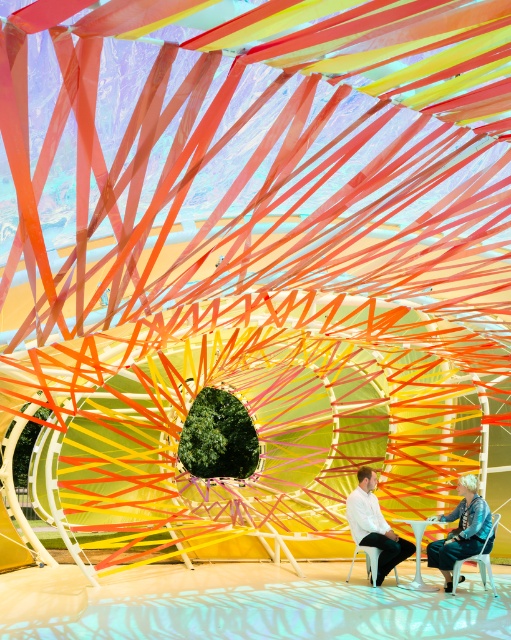
Question: Which is farther from the white plastic chair at lower center?

Choices:
 (A) denim jacket at lower right
 (B) white plastic chair at lower right

Answer: (B)

Question: Is the position of white glossy chair at center less distant than that of white plastic chair at lower center?

Choices:
 (A) yes
 (B) no

Answer: (B)

Question: Which point appears closest to the camera in this image?

Choices:
 (A) coord(355,557)
 (B) coord(467,484)

Answer: (B)

Question: Is white plastic chairs at center thinner than denim jacket at lower right?

Choices:
 (A) yes
 (B) no

Answer: (B)

Question: Among these objects, which one is nearest to the camera?

Choices:
 (A) white glossy chair at center
 (B) denim jacket at lower right
 (C) white plastic chairs at center

Answer: (B)

Question: Is white glossy chair at center further to the viewer compared to white plastic chair at lower center?

Choices:
 (A) yes
 (B) no

Answer: (A)